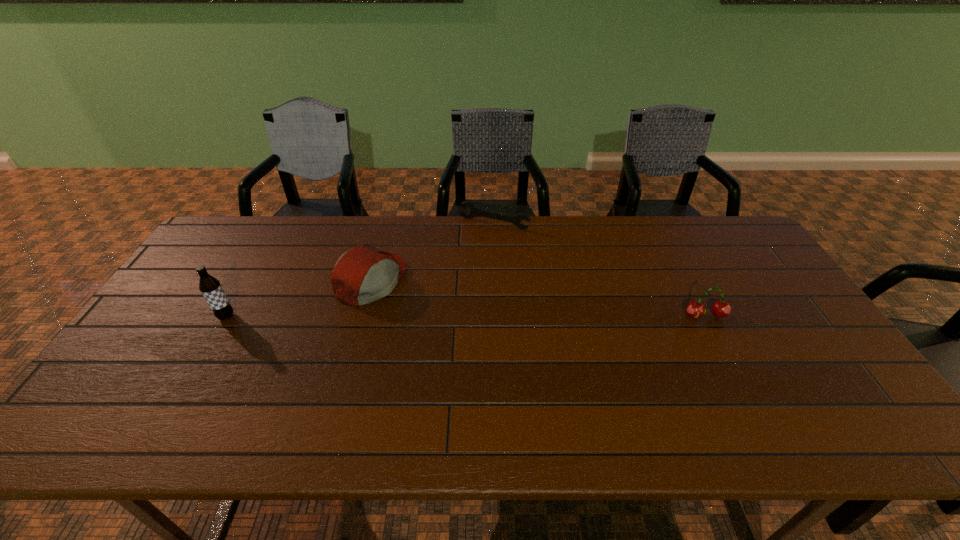
The height and width of the screenshot is (540, 960). I want to click on root beer, so click(210, 287).

Where is `the leftmost object`? The width and height of the screenshot is (960, 540). the leftmost object is located at coordinates (210, 287).

Where is `cherry`? The width and height of the screenshot is (960, 540). cherry is located at coordinates (695, 309).

At what (x,y) coordinates should I click in order to perform the action: click on the third nearest object. Please return your answer as a coordinate pair (x, y). Looking at the image, I should click on (361, 275).

Where is `the second object from left to right`? The height and width of the screenshot is (540, 960). the second object from left to right is located at coordinates (361, 275).

Identify the location of the shortest object. The image size is (960, 540). (474, 211).

Find the location of `the second object from right to left`. the second object from right to left is located at coordinates (474, 211).

At what (x,y) coordinates should I click in order to perform the action: click on vacant space located 0.100m on the back of the root beer. Please return your answer as a coordinate pair (x, y). This screenshot has height=540, width=960. Looking at the image, I should click on (244, 286).

This screenshot has height=540, width=960. Find the location of `free space located 0.200m with stems pointing upwards on the rightmost object`. free space located 0.200m with stems pointing upwards on the rightmost object is located at coordinates (741, 384).

Locate an element on the screen. Image resolution: width=960 pixels, height=540 pixels. vacant space located 0.110m on the front-facing side of the third object from right to left is located at coordinates (428, 307).